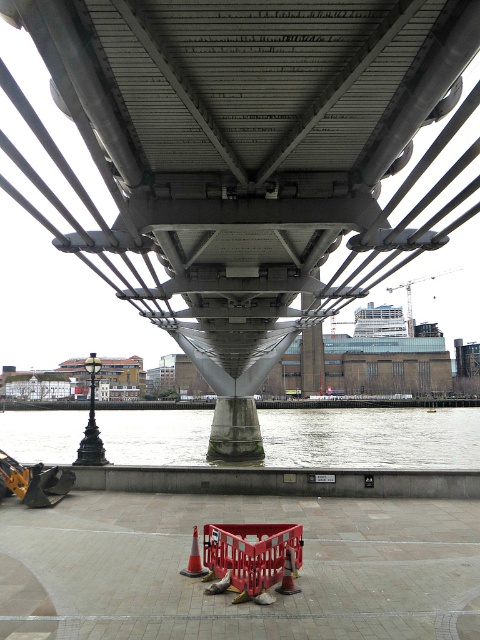
You are a pedestrian standing on the paved area with reddish brown bricks. You see the metallic gray bridge at center and the orange matte traffic cone at lower center. Which object is positioned to the right side from your viewpoint?

The metallic gray bridge at center is positioned to the right of the orange matte traffic cone at lower center.

Looking at this image, you are a construction worker who needs to place a new traffic cone on the paved area under the Millennium Bridge. The gray concrete water at lower center is already present. Can you safely place the orange matte traffic cone at lower center without it being submerged by the water?

The gray concrete water at lower center is taller than the orange matte traffic cone at lower center, so placing the cone there would submerge it since the water is higher.

You are a maintenance worker needing to cross from the gray concrete water at lower center to the red plastic barricade at center. Can you walk directly between them without any obstacles?

The distance between gray concrete water at lower center and red plastic barricade at center is 49.77 meters, so yes, you can walk directly between them without any obstacles as there is enough space.